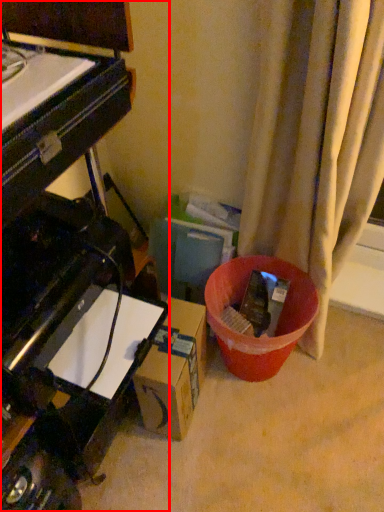
Question: Considering the relative positions of piano (annotated by the red box) and cardboard box in the image provided, where is piano (annotated by the red box) located with respect to the staircase?

Choices:
 (A) left
 (B) right

Answer: (A)